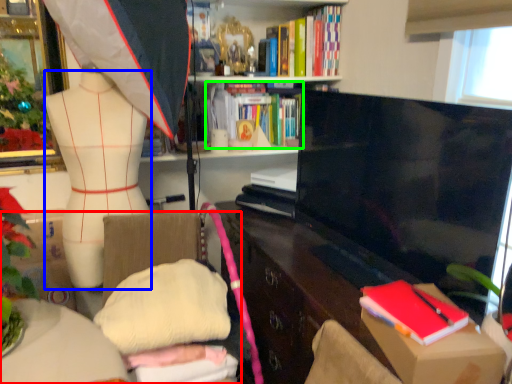
Question: Which is nearer to the furniture (highlighted by a red box)? clothing (highlighted by a blue box) or book (highlighted by a green box).

Choices:
 (A) clothing
 (B) book

Answer: (A)